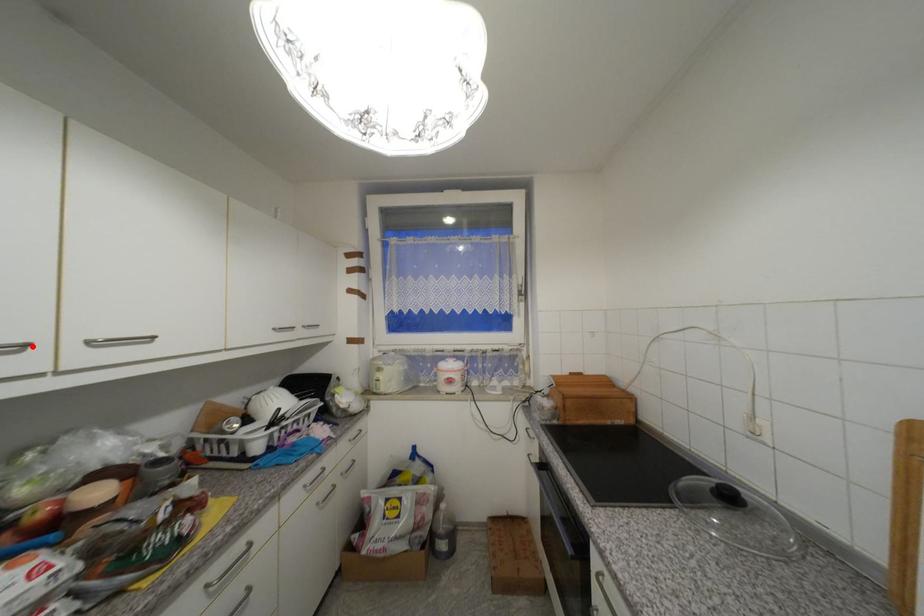
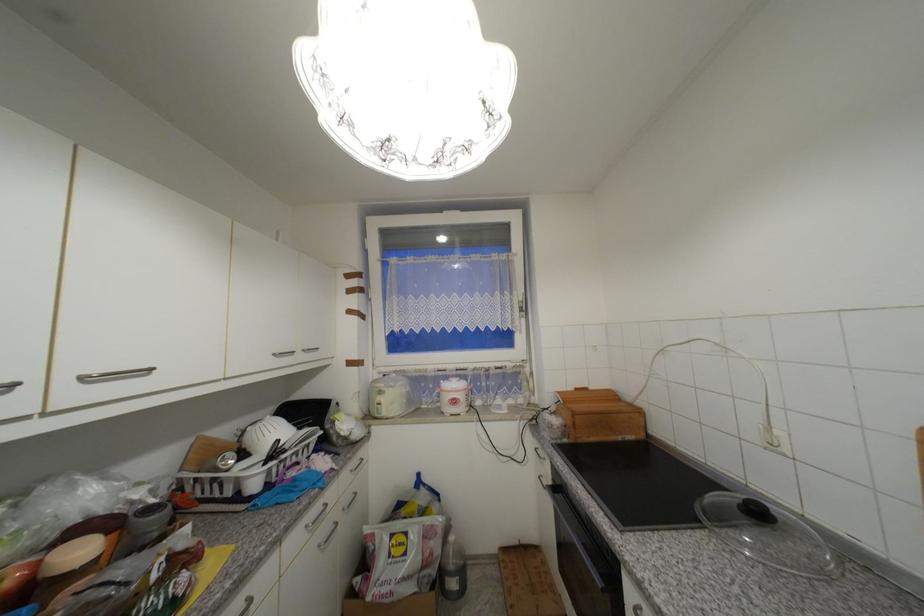
Where in the second image is the point corresponding to the highlighted location from the first image?

(19, 386)